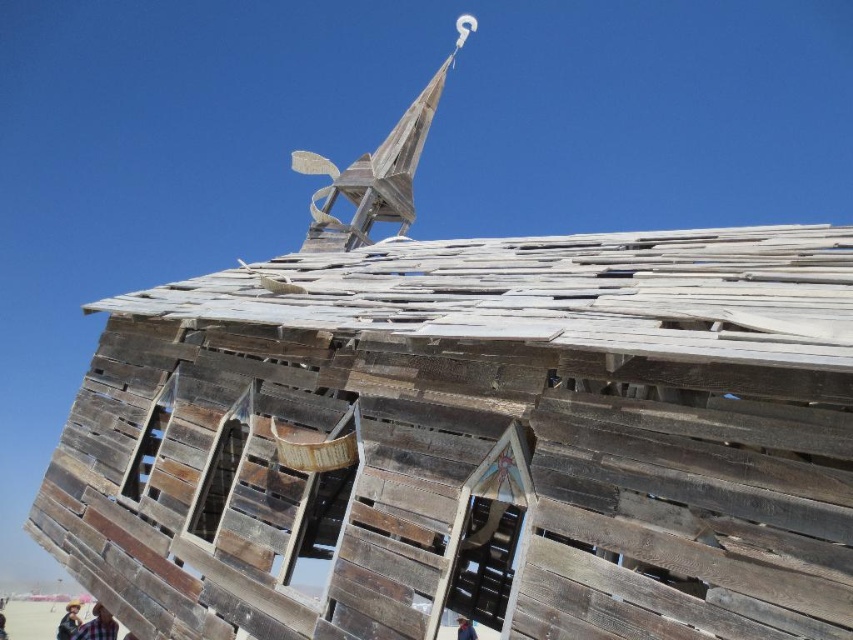
Who is shorter, wooden spire at upper center or wooden planks at lower left?

wooden planks at lower left

Can you confirm if wooden spire at upper center is positioned below wooden planks at lower left?

No.

Find the location of `wooden spire at upper center`. wooden spire at upper center is located at coordinates (375, 172).

Where is `wooden spire at upper center`? This screenshot has height=640, width=853. wooden spire at upper center is located at coordinates (375, 172).

Who is positioned more to the right, wooden spire at upper center or brown leather hat at upper center?

From the viewer's perspective, wooden spire at upper center appears more on the right side.

Measure the distance between wooden spire at upper center and camera.

They are 29.49 meters apart.

What do you see at coordinates (375, 172) in the screenshot? This screenshot has width=853, height=640. I see `wooden spire at upper center` at bounding box center [375, 172].

Image resolution: width=853 pixels, height=640 pixels. Identify the location of wooden spire at upper center. point(375,172).

What do you see at coordinates (97, 625) in the screenshot?
I see `wooden planks at lower left` at bounding box center [97, 625].

Who is shorter, wooden planks at lower left or brown leather hat at upper center?

With less height is brown leather hat at upper center.

Is point (78, 636) closer to viewer compared to point (469, 627)?

That is True.

Where is `wooden planks at lower left`? This screenshot has height=640, width=853. wooden planks at lower left is located at coordinates (97, 625).